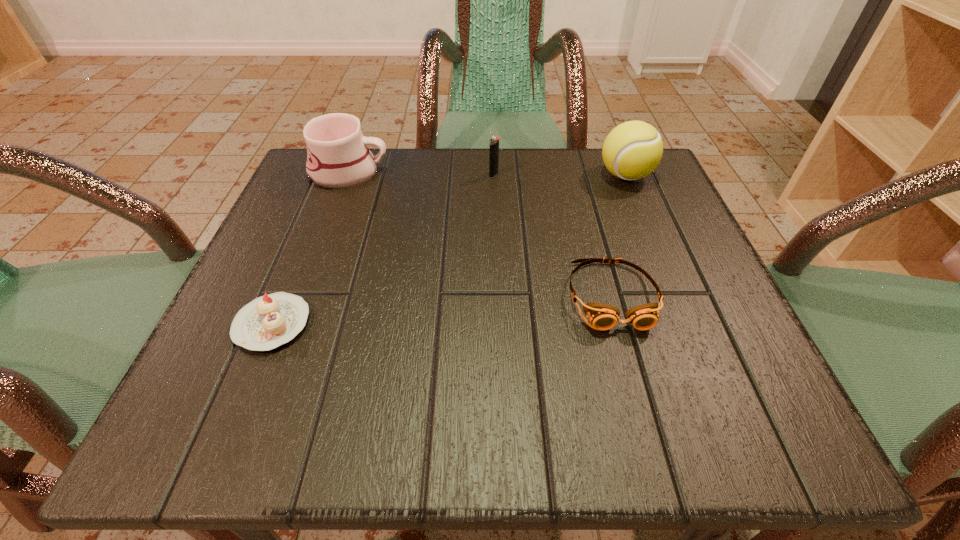
The height and width of the screenshot is (540, 960). Find the location of `tennis ball`. tennis ball is located at coordinates (632, 150).

At what (x,y) coordinates should I click in order to perform the action: click on mug. Please return your answer as a coordinate pair (x, y). The width and height of the screenshot is (960, 540). Looking at the image, I should click on (338, 156).

Identify the location of the third tallest object. The height and width of the screenshot is (540, 960). (494, 141).

Find the location of a particular element. The image size is (960, 540). the third object from right to left is located at coordinates (494, 141).

Locate an element on the screen. The height and width of the screenshot is (540, 960). goggles is located at coordinates (602, 316).

What are the coordinates of `cupcake` in the screenshot? It's located at (267, 322).

Find the location of a particular element. free space located on the left of the tennis ball is located at coordinates (560, 176).

This screenshot has width=960, height=540. I want to click on vacant point located on the side with the handle of the mug, so click(536, 172).

You are a GUI agent. You are given a task and a screenshot of the screen. Output one action in this format:
    pyautogui.click(x=<x>, y=<y>)
    Task: Click on the vacant space situated 0.350m on the left of the third object from right to left
    This screenshot has height=540, width=960.
    Given the screenshot: What is the action you would take?
    pyautogui.click(x=321, y=175)

The image size is (960, 540). I want to click on free spot located 0.090m with the lenses facing forward on the goggles, so pyautogui.click(x=637, y=389).